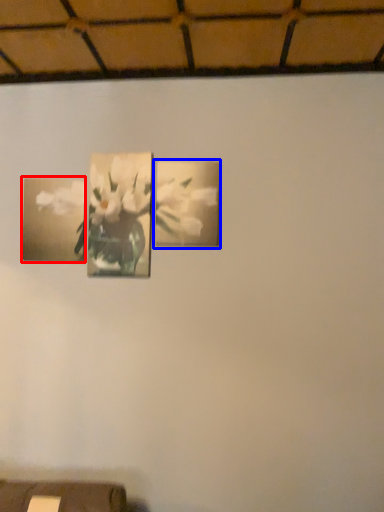
Question: Which object appears farthest to the camera in this image, picture frame (highlighted by a red box) or picture frame (highlighted by a blue box)?

Choices:
 (A) picture frame
 (B) picture frame

Answer: (A)